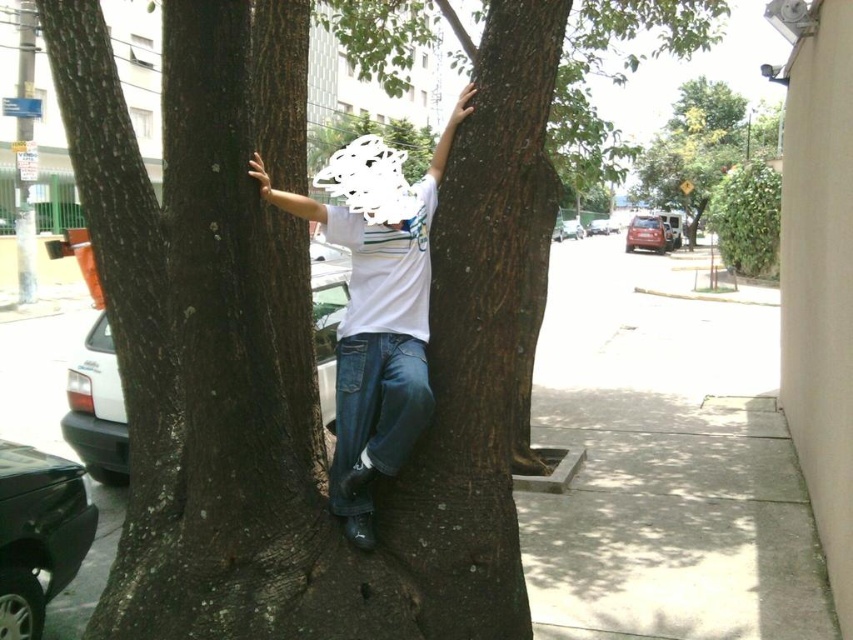
Question: Which point is closer to the camera?

Choices:
 (A) (425, 285)
 (B) (698, 196)

Answer: (A)

Question: Which of the following is the farthest from the observer?

Choices:
 (A) green leafy tree at upper right
 (B) white matte shirt at center

Answer: (A)

Question: Can you confirm if white matte shirt at center is positioned to the right of green leafy tree at upper right?

Choices:
 (A) yes
 (B) no

Answer: (B)

Question: Is white matte shirt at center in front of green leafy tree at upper right?

Choices:
 (A) no
 (B) yes

Answer: (B)

Question: Can you confirm if white matte shirt at center is positioned to the right of green leafy tree at upper right?

Choices:
 (A) yes
 (B) no

Answer: (B)